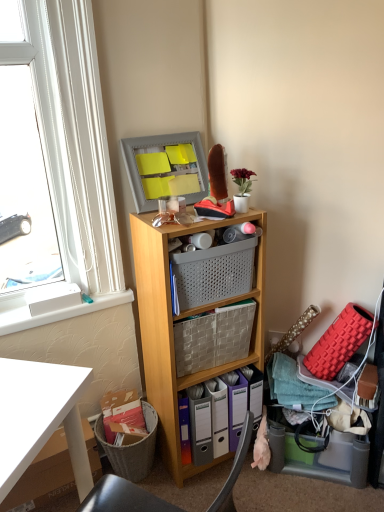
Question: Can gray perforated basket at center, which is counted as the 2th basket, starting from the bottom, be found inside white plastic window sill at upper left?

Choices:
 (A) no
 (B) yes

Answer: (A)

Question: Are white plastic window sill at upper left and gray perforated basket at center, which appears as the first basket when viewed from the top, located far from each other?

Choices:
 (A) yes
 (B) no

Answer: (B)

Question: Is white plastic window sill at upper left positioned with its back to gray perforated basket at center, which is counted as the 2th basket, starting from the bottom?

Choices:
 (A) yes
 (B) no

Answer: (B)

Question: Does white plastic window sill at upper left have a lesser width compared to gray perforated basket at center, which appears as the first basket when viewed from the top?

Choices:
 (A) yes
 (B) no

Answer: (A)

Question: Considering the relative positions of white plastic window sill at upper left and gray perforated basket at center, which appears as the first basket when viewed from the top, in the image provided, is white plastic window sill at upper left behind gray perforated basket at center, which appears as the first basket when viewed from the top,?

Choices:
 (A) yes
 (B) no

Answer: (A)

Question: From the image's perspective, is gray perforated basket at center, which is counted as the 2th basket, starting from the bottom, positioned above or below white plastic window sill at upper left?

Choices:
 (A) below
 (B) above

Answer: (B)

Question: Which is correct: gray perforated basket at center, which appears as the first basket when viewed from the top, is inside white plastic window sill at upper left, or outside of it?

Choices:
 (A) outside
 (B) inside

Answer: (A)

Question: Looking at the image, does gray perforated basket at center, which appears as the first basket when viewed from the top, seem bigger or smaller compared to white plastic window sill at upper left?

Choices:
 (A) big
 (B) small

Answer: (A)

Question: Is gray perforated basket at center, which appears as the first basket when viewed from the top, in front of or behind white plastic window sill at upper left in the image?

Choices:
 (A) front
 (B) behind

Answer: (A)

Question: Choose the correct answer: Is white cardboard box at lower left inside white plastic window at upper left or outside it?

Choices:
 (A) outside
 (B) inside

Answer: (A)

Question: From the image's perspective, is white cardboard box at lower left located above or below white plastic window at upper left?

Choices:
 (A) below
 (B) above

Answer: (A)

Question: Relative to white plastic window at upper left, is white cardboard box at lower left in front or behind?

Choices:
 (A) behind
 (B) front

Answer: (B)

Question: Is white cardboard box at lower left wider or thinner than white plastic window at upper left?

Choices:
 (A) wide
 (B) thin

Answer: (A)

Question: Based on their sizes in the image, would you say woven fabric basket at center, positioned as the second basket in top-to-bottom order, is bigger or smaller than white plastic window at upper left?

Choices:
 (A) big
 (B) small

Answer: (B)

Question: Is woven fabric basket at center, positioned as the 1th basket in bottom-to-top order, inside the boundaries of white plastic window at upper left, or outside?

Choices:
 (A) outside
 (B) inside

Answer: (A)